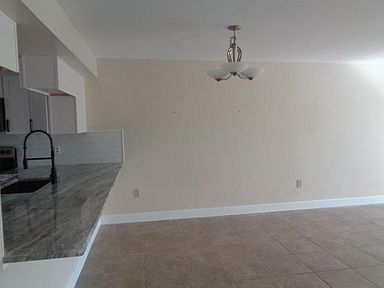
Where is `wall`? The height and width of the screenshot is (288, 384). wall is located at coordinates (93, 149).